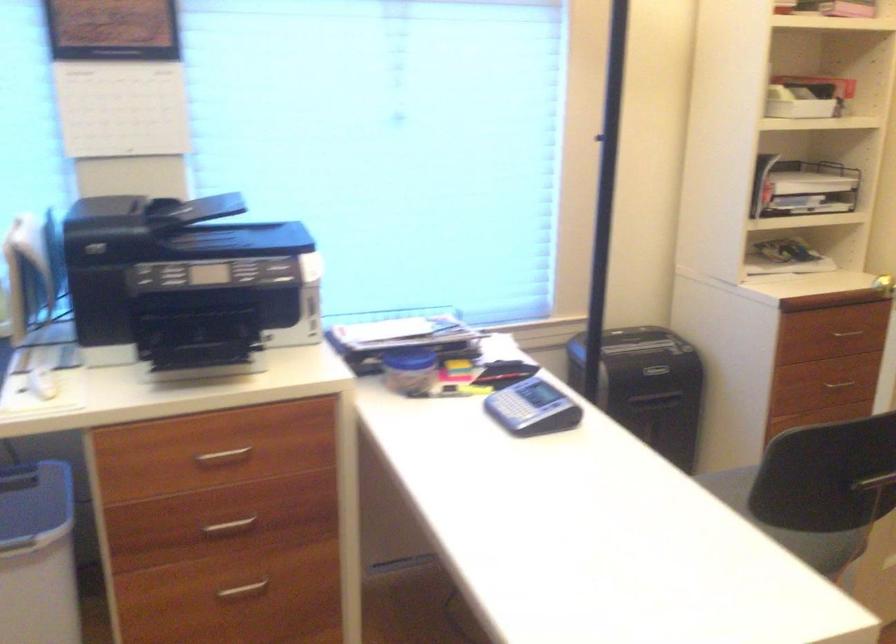
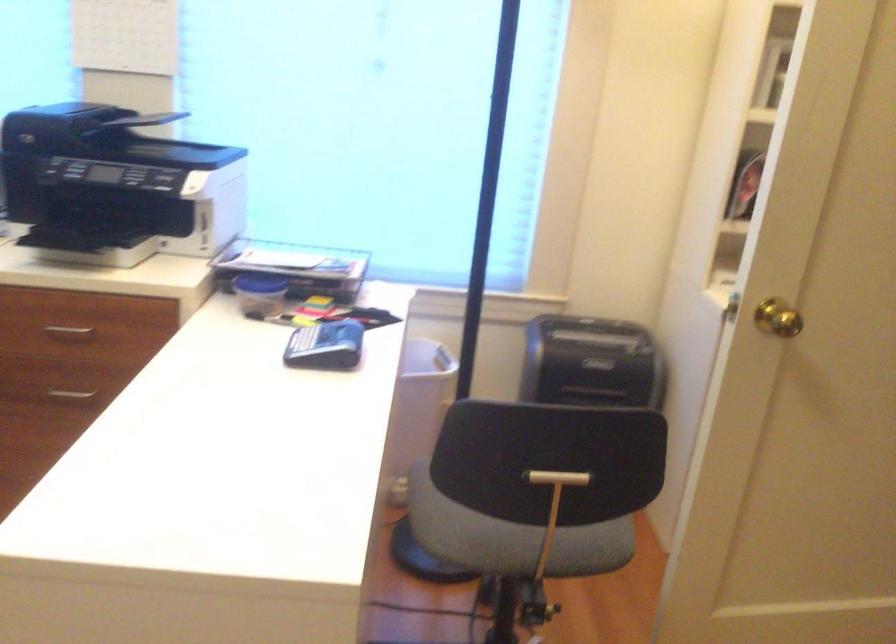
Locate, in the second image, the point that corresponds to the point at 224,458 in the first image.

(69, 332)